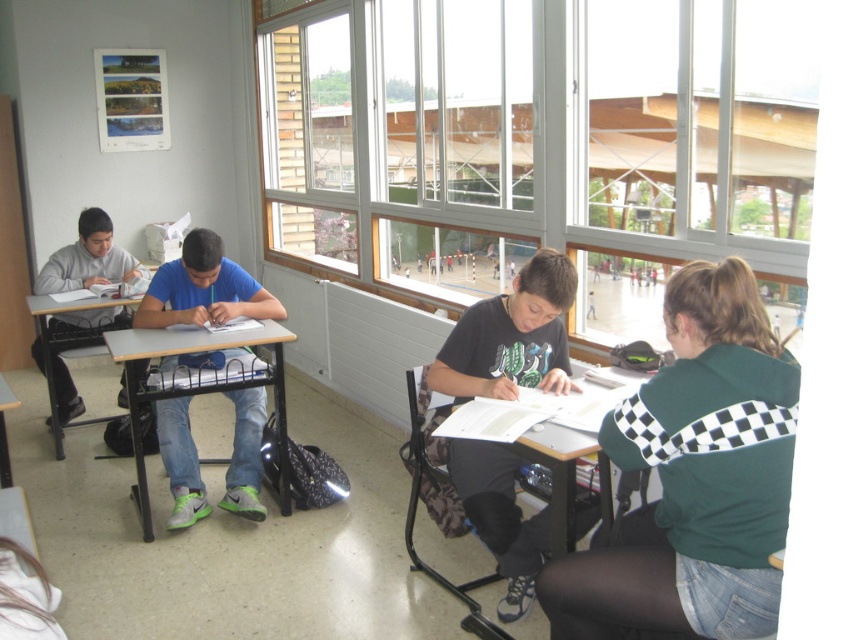
You are a student in the classroom looking at the green checkered jacket at lower right and the matte wood table at center. Which object is closer to the ceiling?

The green checkered jacket at lower right is above the matte wood table at center, so it is closer to the ceiling.

You are a student sitting at the matte wood table at center and want to hand a paper to the student wearing the green checkered jacket at lower right. Since you can only move your arm forward, can you reach them without getting up?

The green checkered jacket at lower right is closer to the viewer than the matte wood table at center, so the student at the matte wood table at center can reach them by extending their arm forward since the jacket is nearer.

You are standing at the center of the classroom. Which direction should you walk to reach the matte black desk at lower right?

You should walk towards the lower right direction to reach the matte black desk at lower right.